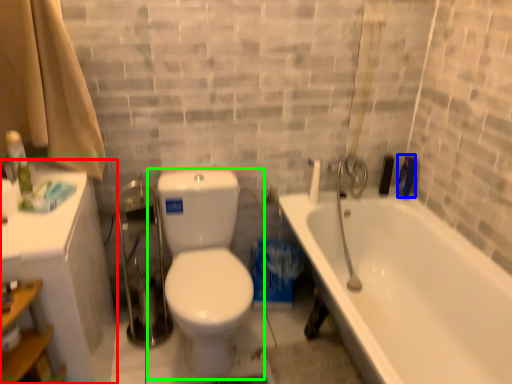
Question: Estimate the real-world distances between objects in this image. Which object is closer to medicine cabinet (highlighted by a red box), toiletry (highlighted by a blue box) or toilet (highlighted by a green box)?

Choices:
 (A) toiletry
 (B) toilet

Answer: (B)